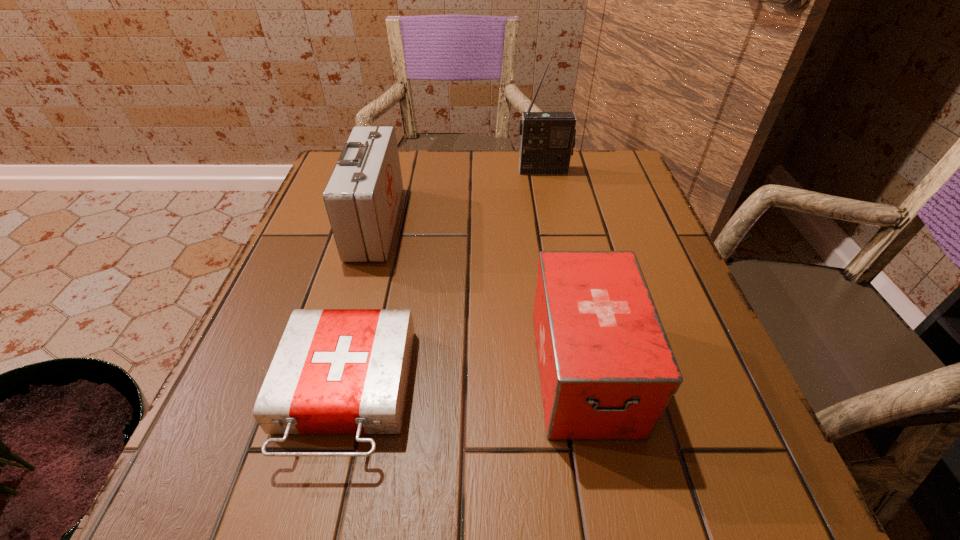
The image size is (960, 540). In order to click on radio receiver located in the far edge section of the desktop in this screenshot , I will do `click(547, 140)`.

Where is `the first-aid kit that is at the far edge`? The image size is (960, 540). the first-aid kit that is at the far edge is located at coordinates (362, 197).

The image size is (960, 540). I want to click on object that is at the near edge, so click(x=336, y=371).

Locate an element on the screen. Image resolution: width=960 pixels, height=540 pixels. radio receiver situated at the right edge is located at coordinates (547, 140).

The width and height of the screenshot is (960, 540). Find the location of `the first-aid kit that is at the right edge`. the first-aid kit that is at the right edge is located at coordinates (607, 371).

You are a GUI agent. You are given a task and a screenshot of the screen. Output one action in this format:
    pyautogui.click(x=<x>, y=<y>)
    Task: Click on the object located at the far left corner
    
    Given the screenshot: What is the action you would take?
    pyautogui.click(x=362, y=197)

Identify the location of object at the near left corner. (336, 371).

What are the coordinates of `object that is at the far right corner` in the screenshot? It's located at pos(547,140).

This screenshot has height=540, width=960. I want to click on free spot at the far edge of the desktop, so click(493, 160).

In the image, there is a desktop. Where is `vacant space at the near edge`? vacant space at the near edge is located at coordinates (561, 499).